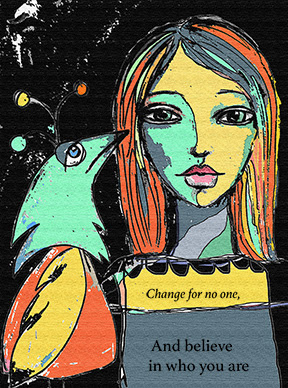
I want to click on art, so click(197, 86).